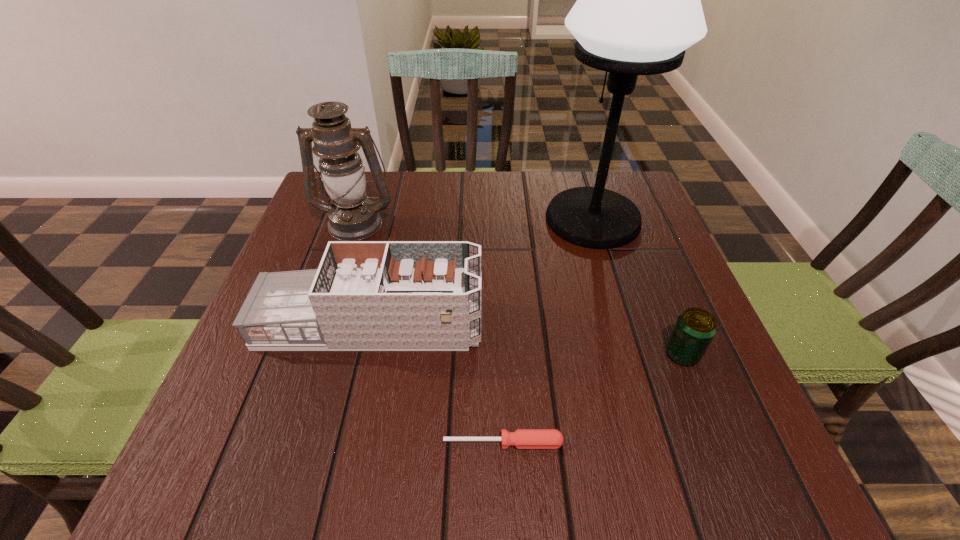
This screenshot has height=540, width=960. Find the location of `vacant space at the far edge`. vacant space at the far edge is located at coordinates (459, 199).

In the image, there is a desktop. Identify the location of free space at the near edge. (472, 489).

This screenshot has width=960, height=540. I want to click on vacant space at the left edge of the desktop, so click(x=263, y=421).

Locate an element on the screen. free space at the right edge is located at coordinates (615, 297).

The image size is (960, 540). In the image, there is a desktop. What are the coordinates of `vacant space at the near left corner` in the screenshot? It's located at pyautogui.click(x=257, y=465).

In the image, there is a desktop. Where is `vacant region at the far right corner`? This screenshot has width=960, height=540. vacant region at the far right corner is located at coordinates (589, 186).

Locate an element on the screen. Image resolution: width=960 pixels, height=540 pixels. vacant space at the near right corner of the desktop is located at coordinates (705, 485).

Image resolution: width=960 pixels, height=540 pixels. I want to click on unoccupied area between the dollhouse and the tallest object, so click(482, 272).

Find the location of a particular element. This screenshot has height=540, width=960. free point between the third shortest object and the beer can is located at coordinates (526, 339).

Image resolution: width=960 pixels, height=540 pixels. I want to click on free space between the screwdriver and the table lamp, so click(x=548, y=331).